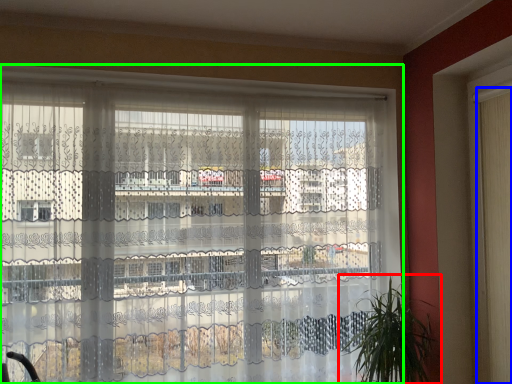
Question: Which is nearer to the houseplant (highlighted by a red box)? shutter (highlighted by a blue box) or window (highlighted by a green box).

Choices:
 (A) shutter
 (B) window

Answer: (A)